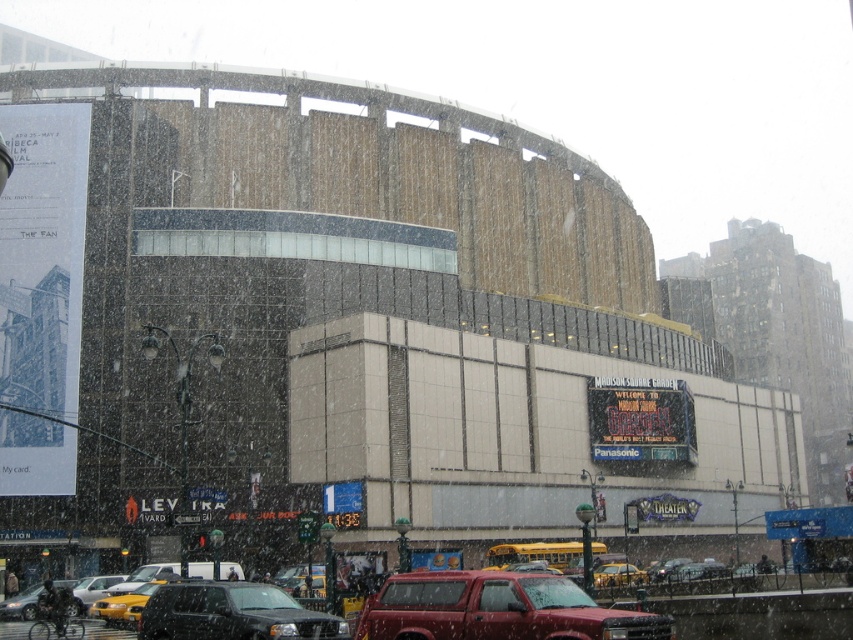
You are a pedestrian standing at the corner of the street, wanting to hail a taxi. You see a yellow rubber taxi at center and a metallic silver sedan at lower left. Which one is closer to you?

The yellow rubber taxi at center is closer to you because the metallic silver sedan at lower left is behind it.

You are standing at the point marked by coordinates [387,604] in the snowy scene near Madison Square Garden. If you want to take a photo of the entire facade of the arena, which direction should you face? Consider the camera position and the distance between you and the camera.

Since the point marked by coordinates [387,604] is 36.33 meters away from the camera, you should face towards the Madison Square Garden facade to capture the entire arena in your photo.

You are a delivery person needing to park your 15 feet long truck between the yellow matte taxi at lower left and the metallic silver sedan at lower left. Is there enough space?

The distance between the yellow matte taxi at lower left and the metallic silver sedan at lower left is 16.78 feet. Since your truck is 15 feet long, there is enough space to park it between them.